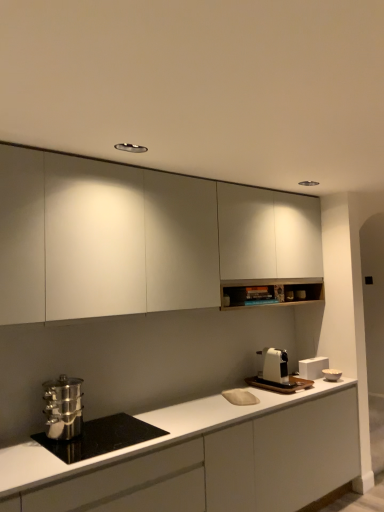
Question: In terms of size, does white matte cabinet at upper center, which appears as the 1th cabinetry when viewed from the top, appear bigger or smaller than stainless steel pot at lower left?

Choices:
 (A) small
 (B) big

Answer: (B)

Question: Is point (59, 195) closer or farther from the camera than point (99, 425)?

Choices:
 (A) closer
 (B) farther

Answer: (A)

Question: Which is farther from the white matte toaster at right, acting as the 2th appliance starting from the right?

Choices:
 (A) white glossy bowl at right, the 1th appliance viewed from the right
 (B) stainless steel steamer at lower left, placed as the 1th kitchen appliance when sorted from front to back
 (C) white plastic coffee machine at right, acting as the 1th kitchen appliance starting from the right
 (D) stainless steel pot at lower left
 (E) white matte countertop at lower left, which appears as the 1th cabinetry when ordered from the bottom

Answer: (B)

Question: Estimate the real-world distances between objects in this image. Which object is closer to the white matte countertop at lower left, the 2th cabinetry from the top?

Choices:
 (A) white plastic coffee machine at right, which is the 1th kitchen appliance from back to front
 (B) stainless steel pot at lower left
 (C) white glossy bowl at right, which ranks as the second appliance in left-to-right order
 (D) white matte toaster at right, which ranks as the 1th appliance in left-to-right order
 (E) stainless steel steamer at lower left, placed as the 1th kitchen appliance when sorted from front to back

Answer: (B)